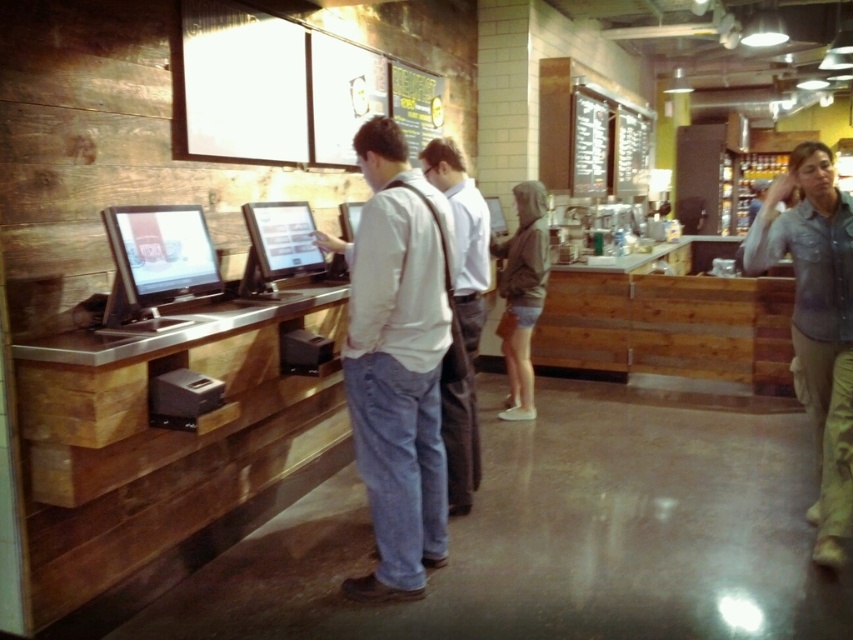
Question: Can you confirm if white shirt at center is thinner than matte black touchscreen at center?

Choices:
 (A) no
 (B) yes

Answer: (A)

Question: Which object is positioned closest to the dark green hoodie at center?

Choices:
 (A) matte black touchscreen at center
 (B) denim shirt at center
 (C) matte black monitor at left
 (D) white shirt at center

Answer: (D)

Question: Is denim shirt at center to the left of matte black monitor at left from the viewer's perspective?

Choices:
 (A) yes
 (B) no

Answer: (B)

Question: Which of the following is the farthest from the observer?

Choices:
 (A) matte black monitor at left
 (B) dark green hoodie at center
 (C) denim shirt at center
 (D) white cotton shirt at center

Answer: (B)

Question: Is white cotton shirt at center closer to the viewer compared to denim shirt at center?

Choices:
 (A) no
 (B) yes

Answer: (B)

Question: Which object is the farthest from the denim shirt at center?

Choices:
 (A) white cotton shirt at center
 (B) matte black touchscreen at center

Answer: (B)